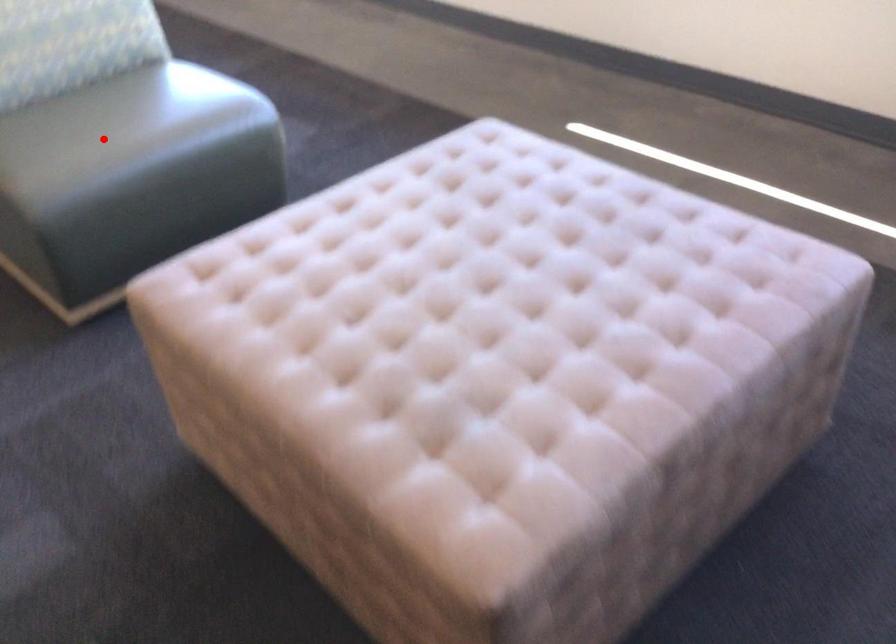
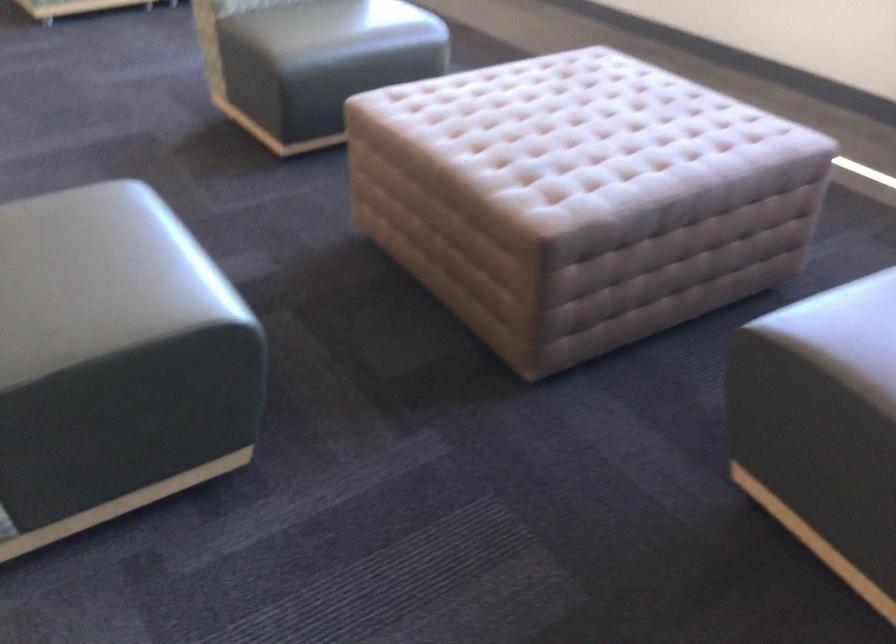
In the second image, find the point that corresponds to the highlighted location in the first image.

(334, 26)